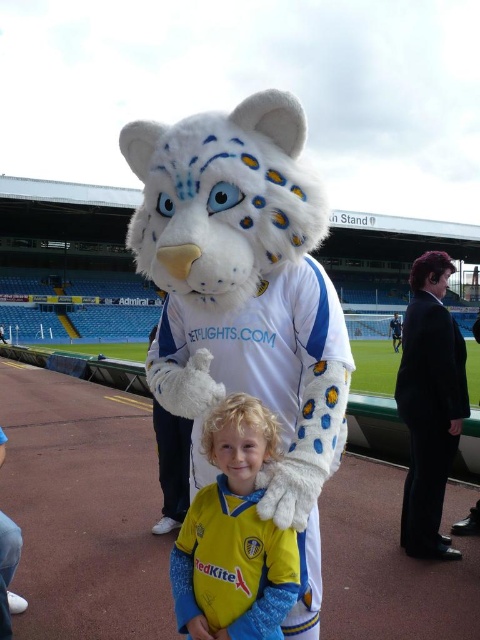
Based on the photo, does yellow jersey at center have a lesser height compared to black suit at right?

Yes.

Does yellow jersey at center have a smaller size compared to black suit at right?

Correct, yellow jersey at center occupies less space than black suit at right.

At what (x,y) coordinates should I click in order to perform the action: click on yellow jersey at center. Please return your answer as a coordinate pair (x, y). This screenshot has width=480, height=640. Looking at the image, I should click on (233, 536).